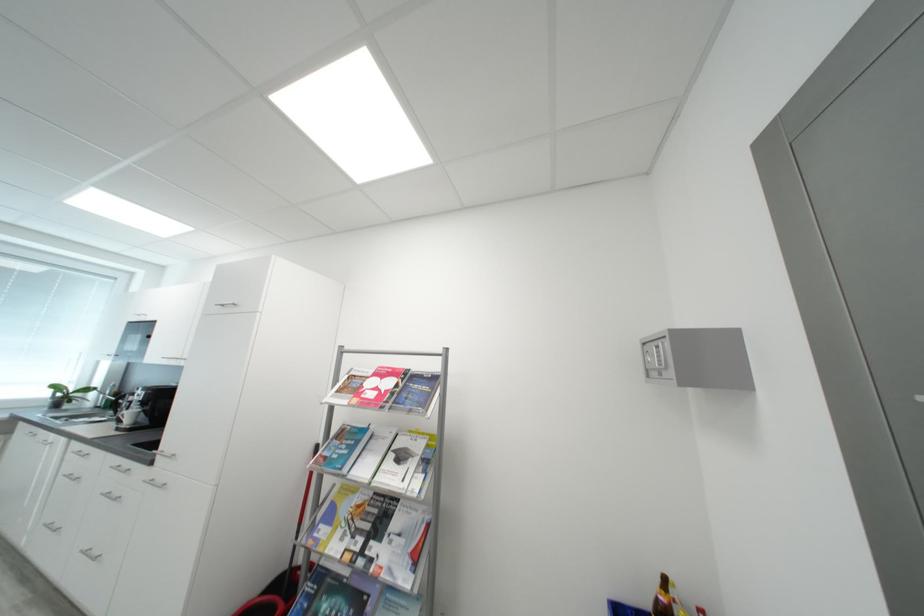
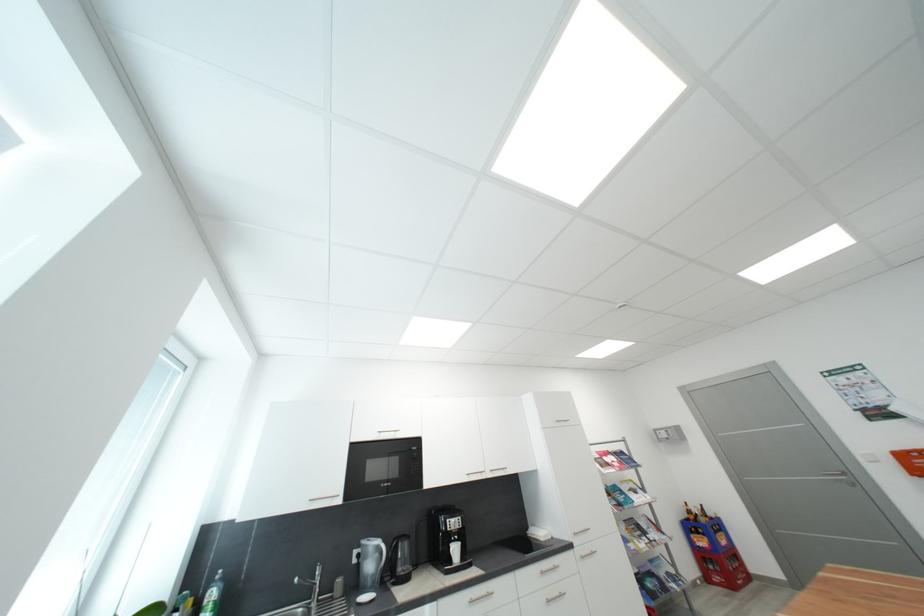
Find the pixel in the second image that matches (x=138, y=416) in the first image.

(463, 552)